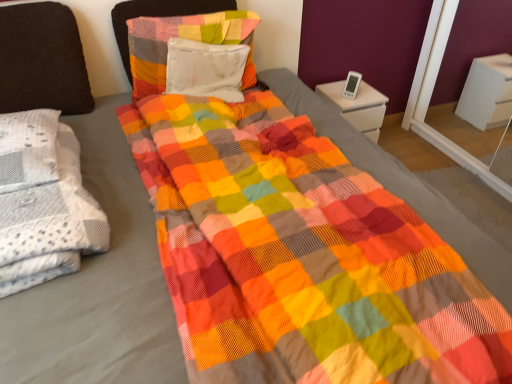
Where is `white glossy nightstand at upper right`? white glossy nightstand at upper right is located at coordinates (357, 106).

The image size is (512, 384). What do you see at coordinates (357, 106) in the screenshot? I see `white glossy nightstand at upper right` at bounding box center [357, 106].

Describe the element at coordinates (42, 60) in the screenshot. The width and height of the screenshot is (512, 384). I see `dark brown fabric pillow at left, which ranks as the 3th pillow in right-to-left order` at that location.

What is the approximate height of dark brown fabric pillow at left, which ranks as the 3th pillow in right-to-left order?

55.16 centimeters.

The height and width of the screenshot is (384, 512). What are the coordinates of `white glossy nightstand at upper right` in the screenshot? It's located at (357, 106).

Between textured cotton pillow at upper center, arranged as the second pillow when viewed from the right, and white glossy nightstand at upper right, which one has larger width?

white glossy nightstand at upper right is wider.

Is textured cotton pillow at upper center, arranged as the second pillow when viewed from the right, at the right side of white glossy nightstand at upper right?

In fact, textured cotton pillow at upper center, arranged as the second pillow when viewed from the right, is to the left of white glossy nightstand at upper right.

Is textured cotton pillow at upper center, which is counted as the second pillow, starting from the left, touching white glossy nightstand at upper right?

textured cotton pillow at upper center, which is counted as the second pillow, starting from the left, is not next to white glossy nightstand at upper right, and they're not touching.

Can you confirm if white glossy nightstand at upper right is bigger than dark brown fabric pillow at left, acting as the first pillow starting from the left?

Yes, white glossy nightstand at upper right is bigger than dark brown fabric pillow at left, acting as the first pillow starting from the left.

How many degrees apart are the facing directions of white glossy nightstand at upper right and dark brown fabric pillow at left, which ranks as the 3th pillow in right-to-left order?

1.58 degrees separate the facing orientations of white glossy nightstand at upper right and dark brown fabric pillow at left, which ranks as the 3th pillow in right-to-left order.

From their relative heights in the image, would you say white glossy nightstand at upper right is taller or shorter than dark brown fabric pillow at left, which ranks as the 3th pillow in right-to-left order?

In the image, white glossy nightstand at upper right appears to be shorter than dark brown fabric pillow at left, which ranks as the 3th pillow in right-to-left order.

Is white glossy nightstand at upper right to the left or to the right of dark brown fabric pillow at left, acting as the first pillow starting from the left, in the image?

In the image, white glossy nightstand at upper right appears on the right side of dark brown fabric pillow at left, acting as the first pillow starting from the left.

Is point (145, 76) in front of point (80, 190)?

No, (145, 76) is behind (80, 190).

In terms of height, does textured cotton pillow at upper center, arranged as the second pillow when viewed from the right, look taller or shorter compared to white textured blanket at left?

Clearly, textured cotton pillow at upper center, arranged as the second pillow when viewed from the right, is taller compared to white textured blanket at left.

Looking at this image, is textured cotton pillow at upper center, which is counted as the second pillow, starting from the left, oriented towards white textured blanket at left?

No.

Does textured cotton pillow at upper center, which is counted as the second pillow, starting from the left, have a lesser width compared to white textured blanket at left?

Indeed, textured cotton pillow at upper center, which is counted as the second pillow, starting from the left, has a lesser width compared to white textured blanket at left.

Can you confirm if white fabric pillow at center, which is the first pillow in right-to-left order, is positioned to the left of white glossy nightstand at upper right?

Correct, you'll find white fabric pillow at center, which is the first pillow in right-to-left order, to the left of white glossy nightstand at upper right.

Is white fabric pillow at center, which is the third pillow from left to right, located outside white glossy nightstand at upper right?

That's correct, white fabric pillow at center, which is the third pillow from left to right, is outside of white glossy nightstand at upper right.

From a real-world perspective, which is physically below, white fabric pillow at center, which is the first pillow in right-to-left order, or white glossy nightstand at upper right?

From a 3D spatial view, white glossy nightstand at upper right is below.

Between white fabric pillow at center, which is the first pillow in right-to-left order, and dark brown fabric pillow at left, which ranks as the 3th pillow in right-to-left order, which one has smaller size?

Smaller between the two is white fabric pillow at center, which is the first pillow in right-to-left order.

From a real-world perspective, between white fabric pillow at center, which is the first pillow in right-to-left order, and dark brown fabric pillow at left, which ranks as the 3th pillow in right-to-left order, who is vertically lower?

white fabric pillow at center, which is the first pillow in right-to-left order.

From the dark brown fabric pillow at left, acting as the first pillow starting from the left, count 1st pillows backward and point to it. Please provide its 2D coordinates.

[(206, 69)]

Is white fabric pillow at center, which is the first pillow in right-to-left order, oriented towards dark brown fabric pillow at left, acting as the first pillow starting from the left?

No.

Considering the sizes of dark brown fabric pillow at left, which ranks as the 3th pillow in right-to-left order, and white textured blanket at left in the image, is dark brown fabric pillow at left, which ranks as the 3th pillow in right-to-left order, taller or shorter than white textured blanket at left?

In the image, dark brown fabric pillow at left, which ranks as the 3th pillow in right-to-left order, appears to be taller than white textured blanket at left.

Based on their positions, is dark brown fabric pillow at left, which ranks as the 3th pillow in right-to-left order, located to the left or right of white textured blanket at left?

Clearly, dark brown fabric pillow at left, which ranks as the 3th pillow in right-to-left order, is on the left of white textured blanket at left in the image.

Is dark brown fabric pillow at left, which ranks as the 3th pillow in right-to-left order, touching white textured blanket at left?

No.

From a real-world perspective, is dark brown fabric pillow at left, acting as the first pillow starting from the left, physically below white textured blanket at left?

Actually, dark brown fabric pillow at left, acting as the first pillow starting from the left, is physically above white textured blanket at left in the real world.

In order to click on nightstand behind the white textured blanket at left in this screenshot , I will do pos(357,106).

Can you confirm if white textured blanket at left is shorter than white glossy nightstand at upper right?

Correct, white textured blanket at left is not as tall as white glossy nightstand at upper right.

Is white textured blanket at left not near white glossy nightstand at upper right?

Yes.

From the image's perspective, relative to white glossy nightstand at upper right, is white textured blanket at left above or below?

Clearly, from the image's perspective, white textured blanket at left is below white glossy nightstand at upper right.

In order to click on nightstand directly beneath the textured cotton pillow at upper center, arranged as the second pillow when viewed from the right (from a real-world perspective) in this screenshot , I will do `click(357, 106)`.

The image size is (512, 384). In order to click on nightstand on the right of dark brown fabric pillow at left, which ranks as the 3th pillow in right-to-left order in this screenshot , I will do `click(357, 106)`.

From the image, which object appears to be farther from dark brown fabric pillow at left, which ranks as the 3th pillow in right-to-left order, white glossy nightstand at upper right or white fabric pillow at center, which is the third pillow from left to right?

Based on the image, white glossy nightstand at upper right appears to be further to dark brown fabric pillow at left, which ranks as the 3th pillow in right-to-left order.

When comparing their distances from white glossy nightstand at upper right, does white fabric pillow at center, which is the first pillow in right-to-left order, or white textured blanket at left seem further?

Among the two, white textured blanket at left is located further to white glossy nightstand at upper right.

Looking at the image, which one is located further to white fabric pillow at center, which is the third pillow from left to right, white textured blanket at left or dark brown fabric pillow at left, which ranks as the 3th pillow in right-to-left order?

Based on the image, white textured blanket at left appears to be further to white fabric pillow at center, which is the third pillow from left to right.

Consider the image. When comparing their distances from white glossy nightstand at upper right, does white fabric pillow at center, which is the third pillow from left to right, or textured cotton pillow at upper center, which is counted as the second pillow, starting from the left, seem closer?

white fabric pillow at center, which is the third pillow from left to right, is closer to white glossy nightstand at upper right.

Looking at the image, which one is located further to dark brown fabric pillow at left, acting as the first pillow starting from the left, white textured blanket at left or white fabric pillow at center, which is the first pillow in right-to-left order?

Based on the image, white textured blanket at left appears to be further to dark brown fabric pillow at left, acting as the first pillow starting from the left.

When comparing their distances from textured cotton pillow at upper center, arranged as the second pillow when viewed from the right, does white glossy nightstand at upper right or dark brown fabric pillow at left, which ranks as the 3th pillow in right-to-left order, seem closer?

dark brown fabric pillow at left, which ranks as the 3th pillow in right-to-left order, is closer to textured cotton pillow at upper center, arranged as the second pillow when viewed from the right.

When comparing their distances from white fabric pillow at center, which is the first pillow in right-to-left order, does white glossy nightstand at upper right or white textured blanket at left seem further?

white textured blanket at left is further to white fabric pillow at center, which is the first pillow in right-to-left order.

Looking at the image, which one is located closer to white textured blanket at left, white fabric pillow at center, which is the third pillow from left to right, or white glossy nightstand at upper right?

Based on the image, white fabric pillow at center, which is the third pillow from left to right, appears to be nearer to white textured blanket at left.

You are a GUI agent. You are given a task and a screenshot of the screen. Output one action in this format:
    pyautogui.click(x=<x>, y=<y>)
    Task: Click on the pillow between dark brown fabric pillow at left, which ranks as the 3th pillow in right-to-left order, and white fabric pillow at center, which is the third pillow from left to right
    This screenshot has width=512, height=384.
    Given the screenshot: What is the action you would take?
    pyautogui.click(x=184, y=38)

The width and height of the screenshot is (512, 384). I want to click on blanket located between dark brown fabric pillow at left, acting as the first pillow starting from the left, and white glossy nightstand at upper right in the left-right direction, so click(x=50, y=224).

Locate an element on the screen. The height and width of the screenshot is (384, 512). pillow located between white textured blanket at left and white fabric pillow at center, which is the first pillow in right-to-left order, in the depth direction is located at coordinates (42, 60).

The image size is (512, 384). I want to click on pillow between textured cotton pillow at upper center, which is counted as the second pillow, starting from the left, and white glossy nightstand at upper right, so click(x=206, y=69).